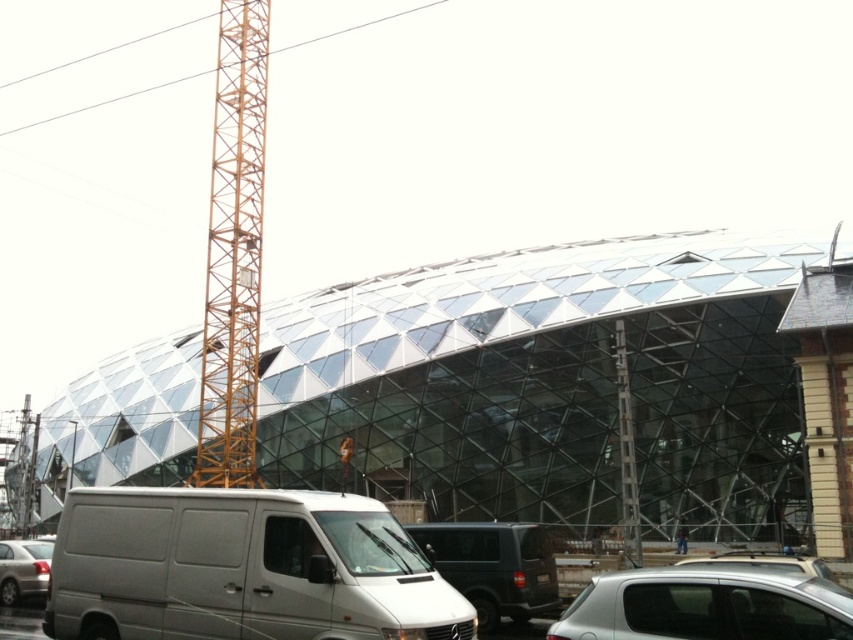
Does yellow metal tower at left appear on the right side of matte black van at center?

In fact, yellow metal tower at left is to the left of matte black van at center.

Is point (234, 438) positioned in front of point (425, 554)?

No, (234, 438) is behind (425, 554).

Between point (206, 330) and point (502, 531), which one is positioned behind?

Positioned behind is point (206, 330).

You are a GUI agent. You are given a task and a screenshot of the screen. Output one action in this format:
    pyautogui.click(x=<x>, y=<y>)
    Task: Click on the yellow metal tower at left
    Image resolution: width=853 pixels, height=640 pixels.
    Given the screenshot: What is the action you would take?
    pyautogui.click(x=233, y=252)

Can you confirm if transparent glass stadium at center is positioned below yellow metal tower at left?

Yes.

Which of these two, transparent glass stadium at center or yellow metal tower at left, stands shorter?

transparent glass stadium at center is shorter.

Where is `transparent glass stadium at center`? transparent glass stadium at center is located at coordinates (570, 387).

Does transparent glass stadium at center have a smaller size compared to silver metallic van at lower left?

No.

Between point (265, 349) and point (4, 540), which one is positioned in front?

Point (4, 540) is more forward.

Find the location of a particular element. transparent glass stadium at center is located at coordinates (570, 387).